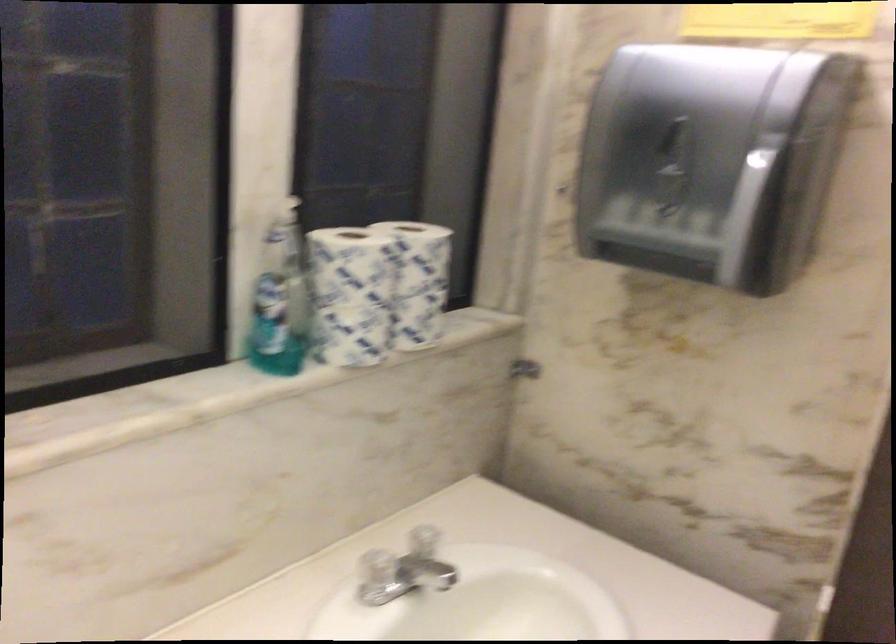
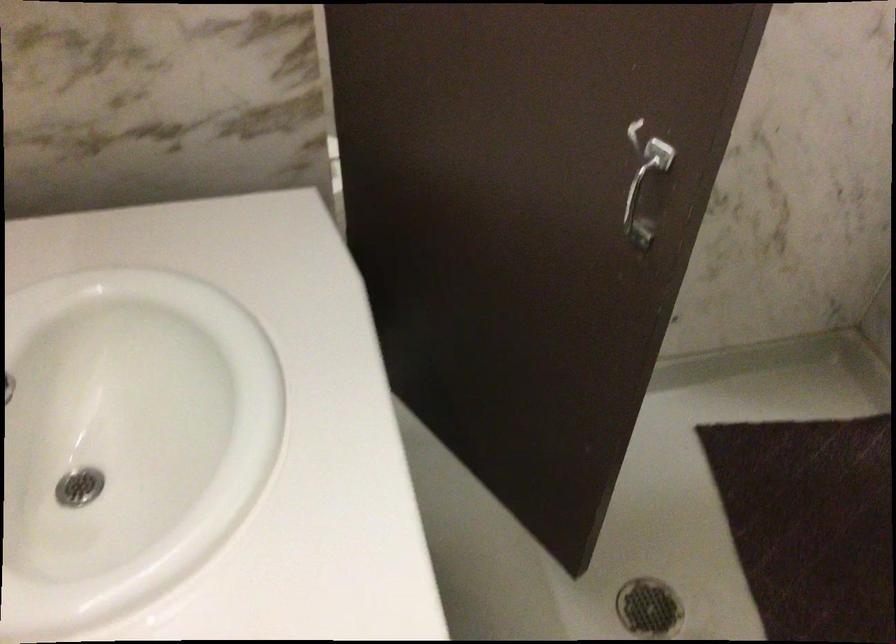
In the scene shown: How did the camera likely rotate?

The camera rotated toward right-down.